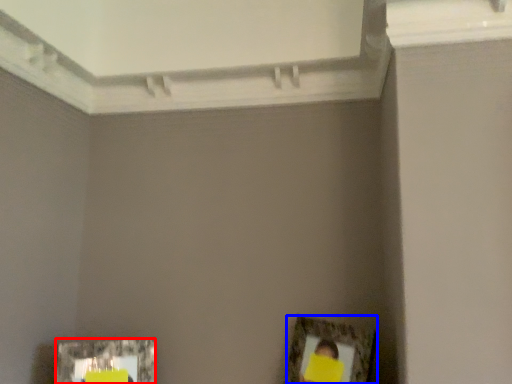
Question: Which object is further to the camera taking this photo, picture frame (highlighted by a red box) or picture frame (highlighted by a blue box)?

Choices:
 (A) picture frame
 (B) picture frame

Answer: (A)